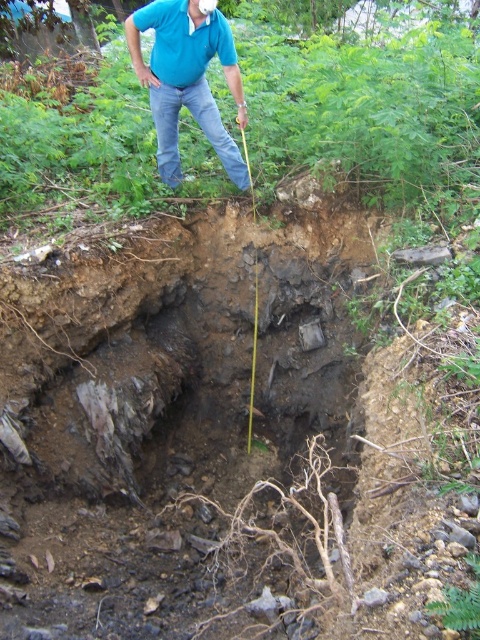
Based on the photo, you are a construction worker standing near the excavation. You need to hand a tool to your colleague wearing the blue cotton shirt at upper center. The tool you have is 12 feet long. Can you reach them without moving closer? Please explain your reasoning.

The blue cotton shirt at upper center is 11.58 feet from the camera. Since the tool is 12 feet long, which is slightly longer than the distance between you and your colleague, you can reach them without moving closer.

You are a fashion designer observing a person in an outdoor setting. You notice the blue cotton shirt at upper center and the jeans at upper center. How far apart are these two clothing items on the person?

The blue cotton shirt at upper center and jeans at upper center are 8.01 centimeters apart.

You are a safety inspector evaluating the attire of the worker in the image. The safety guidelines require that all clothing items must have a minimum width of 50 cm to ensure proper visibility. Given that the blue cotton polo shirt at upper center and jeans at upper center are both visible, can you determine if either of them meets the width requirement?

The blue cotton polo shirt at upper center has a width less than the jeans at upper center. Since the jeans at upper center are wider than the polo shirt, and the minimum required width is 50 cm, it is possible that the jeans might meet the requirement while the polo shirt does not. However, without specific measurements, we cannot confirm definitively.